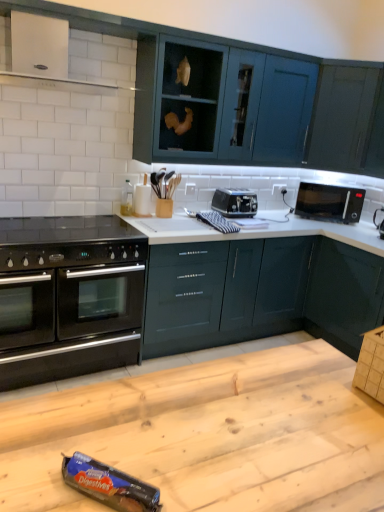
The height and width of the screenshot is (512, 384). In order to click on vacant point to the left of brown cardboard box at lower right in this screenshot , I will do `click(334, 386)`.